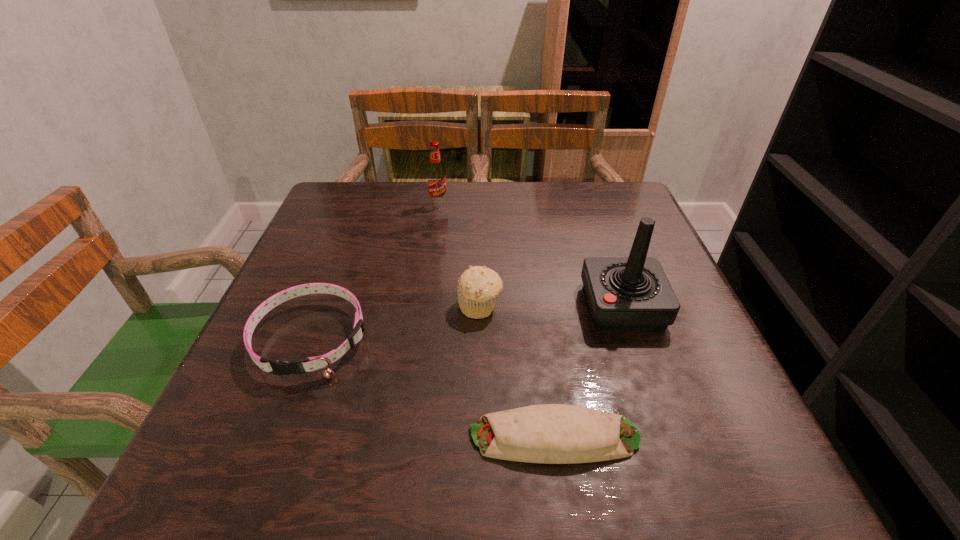
Locate an element on the screen. Image resolution: width=960 pixels, height=540 pixels. joystick is located at coordinates point(632,293).

Where is `the second object from left to right`? This screenshot has height=540, width=960. the second object from left to right is located at coordinates (436, 176).

You are a GUI agent. You are given a task and a screenshot of the screen. Output one action in this format:
    pyautogui.click(x=<x>, y=<y>)
    Task: Click on the fourth shortest object
    The height and width of the screenshot is (540, 960).
    Given the screenshot: What is the action you would take?
    [436, 176]

The image size is (960, 540). Find the location of `the third tallest object`. the third tallest object is located at coordinates (478, 287).

Identify the location of the fourth tallest object. This screenshot has height=540, width=960. (278, 367).

Find the location of a particular element. Image resolution: width=960 pixels, height=540 pixels. the leftmost object is located at coordinates (278, 367).

Locate an element on the screen. The height and width of the screenshot is (540, 960). burrito is located at coordinates (548, 433).

Locate an element on the screen. the shortest object is located at coordinates (548, 433).

Find the location of a particular element. The width and height of the screenshot is (960, 540). vacant area situated on the front-facing side of the joystick is located at coordinates 535,306.

The image size is (960, 540). I want to click on free region located on the front-facing side of the joystick, so click(x=445, y=306).